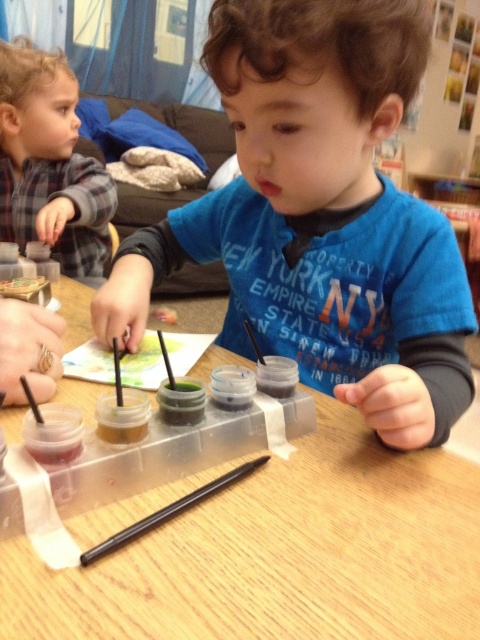
Can you confirm if wooden table at center is taller than black plastic crayon at center?

Yes.

Does wooden table at center have a lesser height compared to black plastic crayon at center?

Incorrect, wooden table at center's height does not fall short of black plastic crayon at center's.

Does point (235, 513) come in front of point (104, 545)?

No, it is not.

Where is `wooden table at center`? wooden table at center is located at coordinates (282, 554).

Who is higher up, plaid flannel shirt at upper left or black plastic crayon at center?

plaid flannel shirt at upper left is above.

Is plaid flannel shirt at upper left bigger than black plastic crayon at center?

Yes.

The width and height of the screenshot is (480, 640). Find the location of `plaid flannel shirt at upper left`. plaid flannel shirt at upper left is located at coordinates (49, 163).

Find the location of a particular element. This screenshot has height=640, width=480. plaid flannel shirt at upper left is located at coordinates (49, 163).

Is blue matte shirt at center positioned behind wooden table at center?

Yes.

Between blue matte shirt at center and wooden table at center, which one appears on the right side from the viewer's perspective?

blue matte shirt at center

Measure the distance between blue matte shirt at center and camera.

A distance of 16.00 inches exists between blue matte shirt at center and camera.

Where is `blue matte shirt at center`? This screenshot has height=640, width=480. blue matte shirt at center is located at coordinates (320, 216).